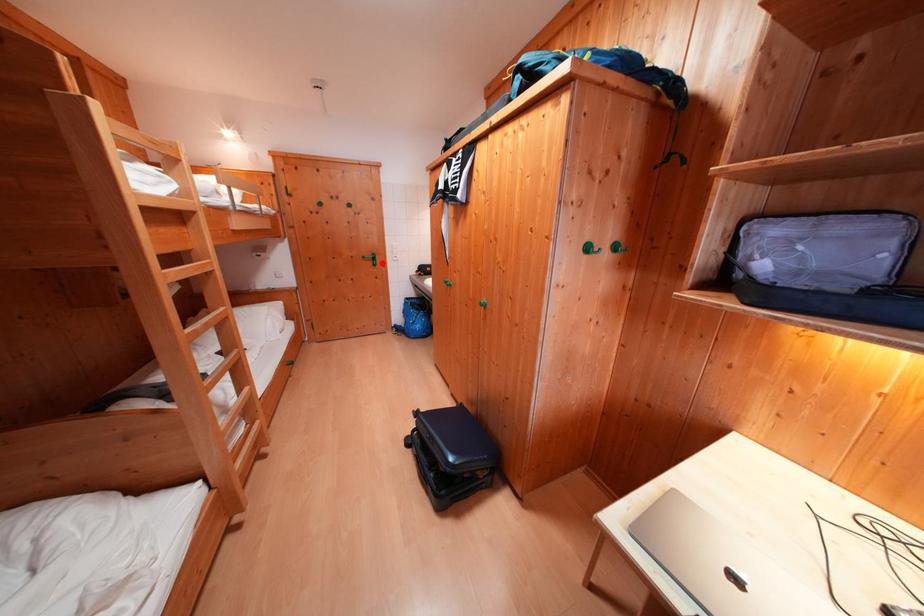
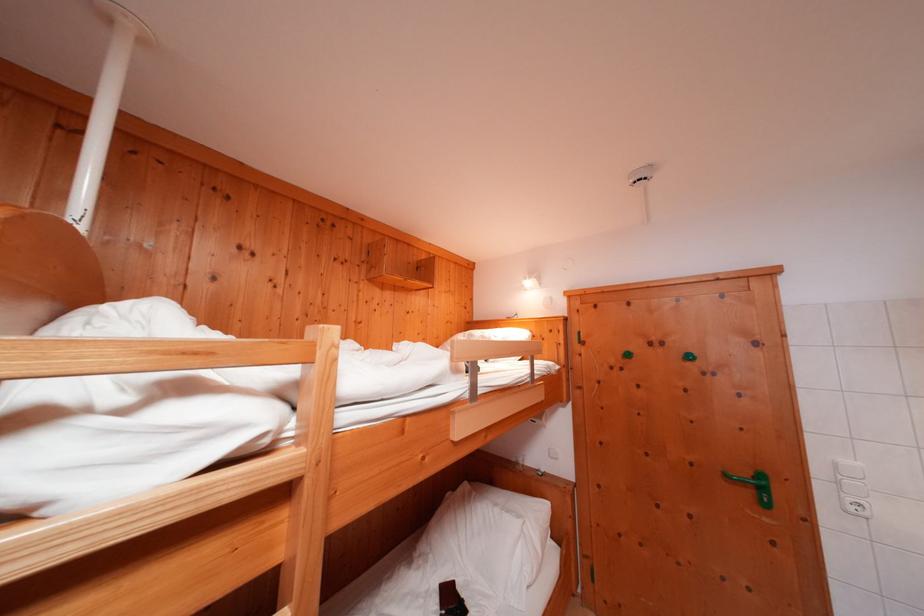
Question: I am providing you with two images of the same scene from different viewpoints. A red point is shown in image1. For the corresponding object point in image2, is it positioned nearer or farther from the camera?

Choices:
 (A) Nearer
 (B) Farther

Answer: (B)